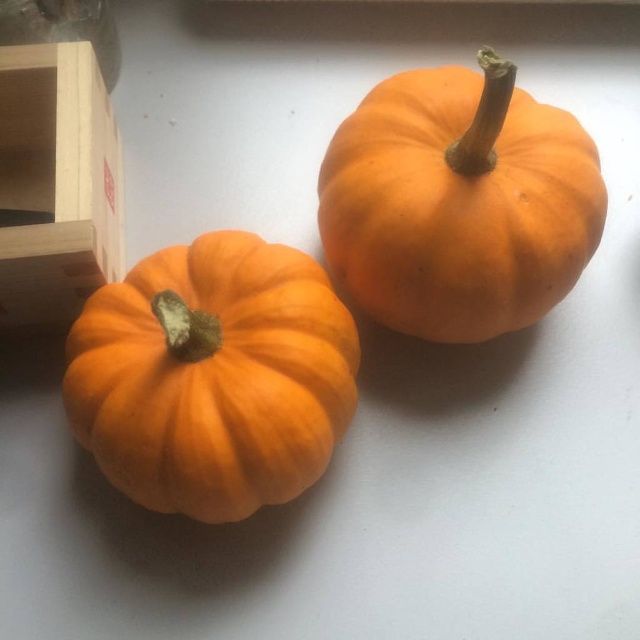
You are standing in a kitchen and want to place a decorative plate on the counter. The plate requires at least 3 feet of space between it and the nearest object. Can you place it between you and the orange matte pumpkin at lower left?

The distance between you and the orange matte pumpkin at lower left is 3.44 feet, which is more than the required 3 feet. Therefore, you can safely place the decorative plate there.

You are positioning a camera to capture the orange matte pumpkin at lower left. What are the coordinates of this pumpkin?

The orange matte pumpkin at lower left is located at point (212, 376).

You are setting up a display and want to arrange the orange matte pumpkin at lower left and the orange matte pumpkin at upper right in a way that the taller one is placed behind the shorter one. Based on their sizes, which pumpkin should be placed in the back?

The orange matte pumpkin at upper right should be placed in the back because it is taller than the orange matte pumpkin at lower left.